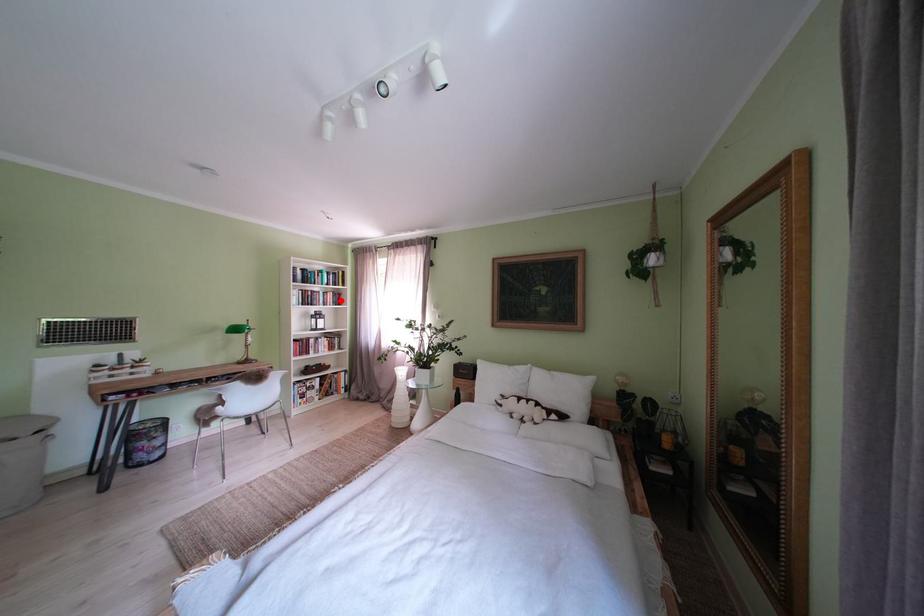
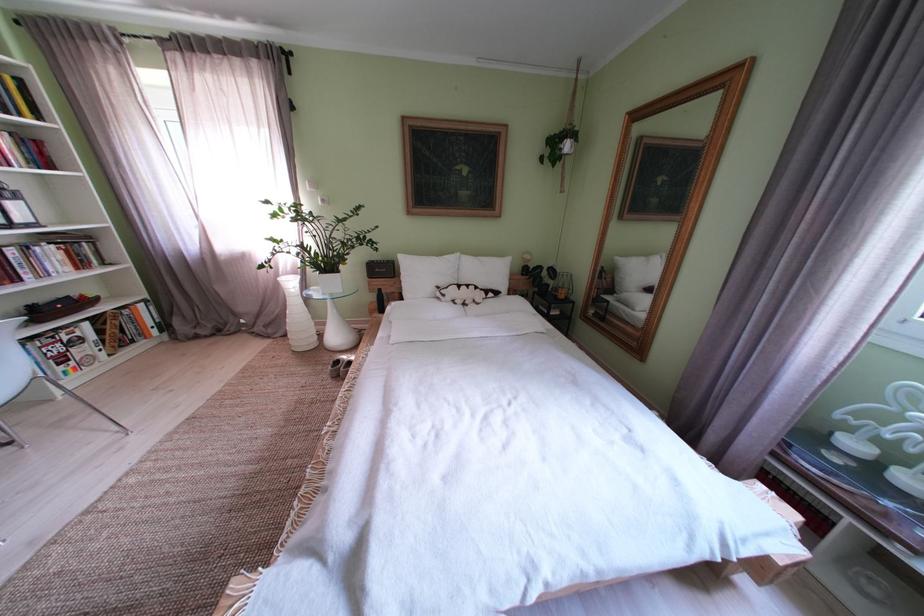
Question: I am providing you with two images of the same scene from different viewpoints. A red point is shown in image1. For the corresponding object point in image2, is it positioned nearer or farther from the camera?

Choices:
 (A) Nearer
 (B) Farther

Answer: (B)